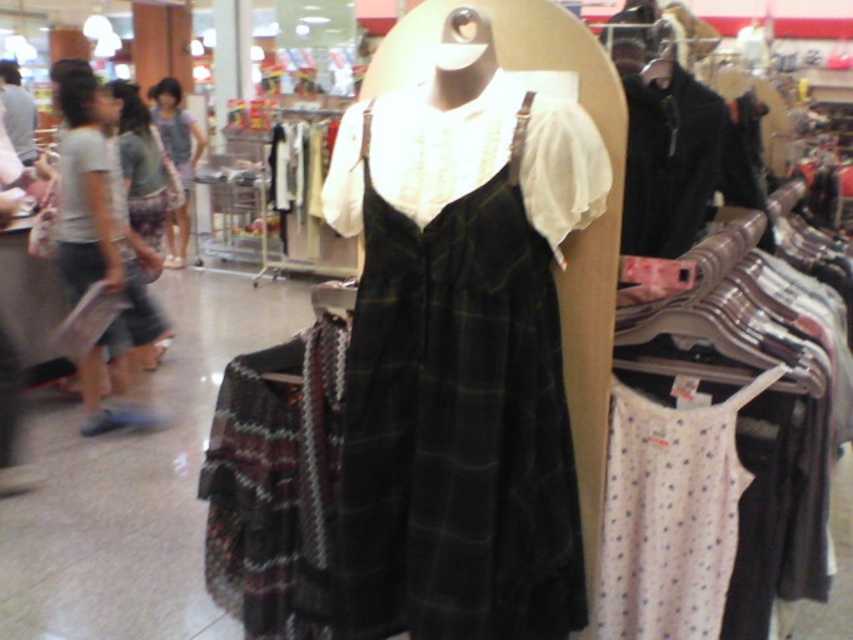
You are a customer in a clothing store looking for a new outfit. You see the white dotted fabric at lower right and the black wool coat at upper right. Which item has a smaller width?

The white dotted fabric at lower right has a smaller width than the black wool coat at upper right.

You are a store employee who needs to determine which garment takes up more space on the rack. Which one is larger between the black wool coat at upper right and the matte green dress at left?

The matte green dress at left is larger than the black wool coat at upper right, so it takes up more space on the rack.